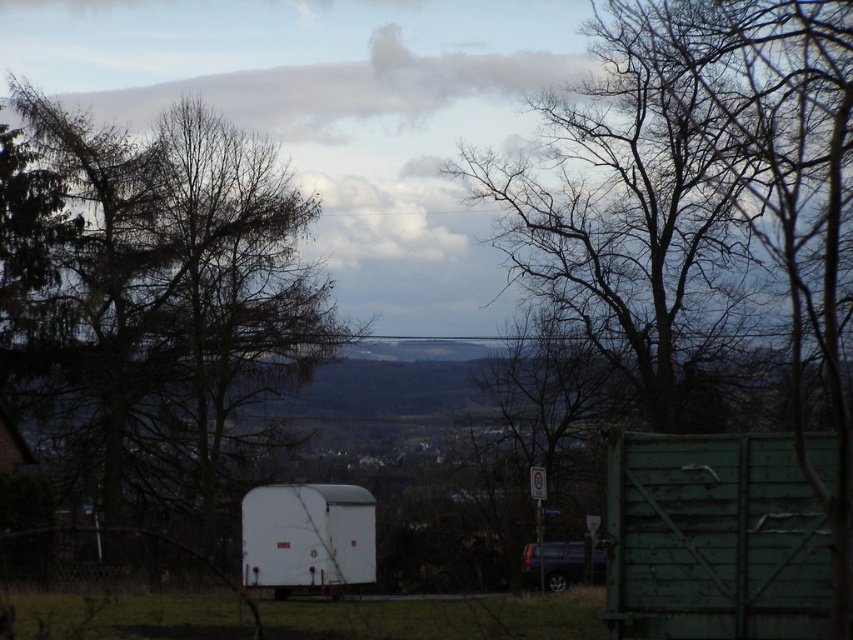
Question: Does dark brown bark tree at left have a larger size compared to white matte trailer at center?

Choices:
 (A) no
 (B) yes

Answer: (B)

Question: Is the position of dark brown bark tree at left more distant than that of white matte trailer at center?

Choices:
 (A) no
 (B) yes

Answer: (A)

Question: Which object is farther from the camera taking this photo?

Choices:
 (A) white matte trailer at center
 (B) dark brown bark tree at left

Answer: (A)

Question: Does dark brown bark tree at left appear under white matte trailer at center?

Choices:
 (A) no
 (B) yes

Answer: (A)